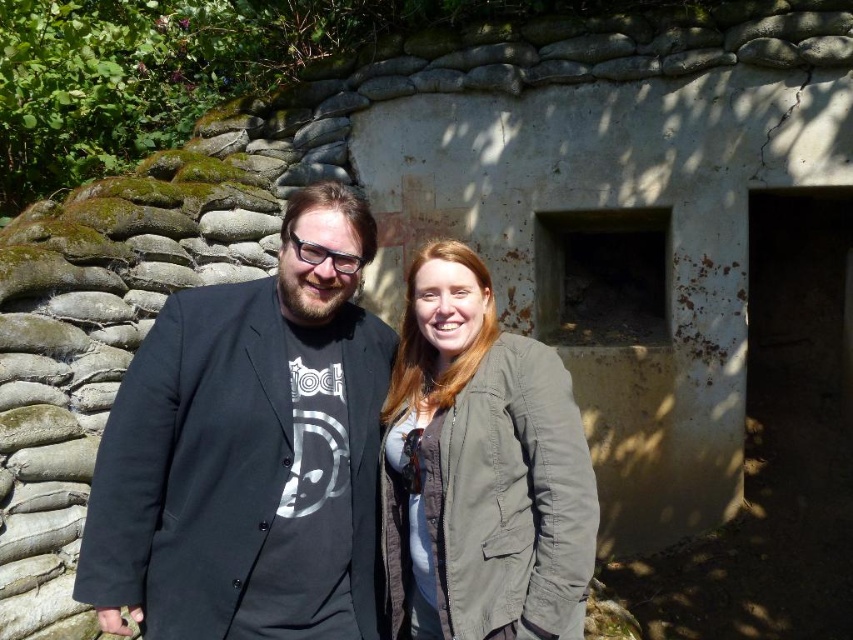
You are a photographer trying to capture both the black matte jacket at center and the green matte jacket at center in a single shot. Which jacket should you focus on first to ensure both are in focus?

The black matte jacket at center is further to the viewer than the green matte jacket at center, so you should focus on the black matte jacket at center first to ensure both are in focus.